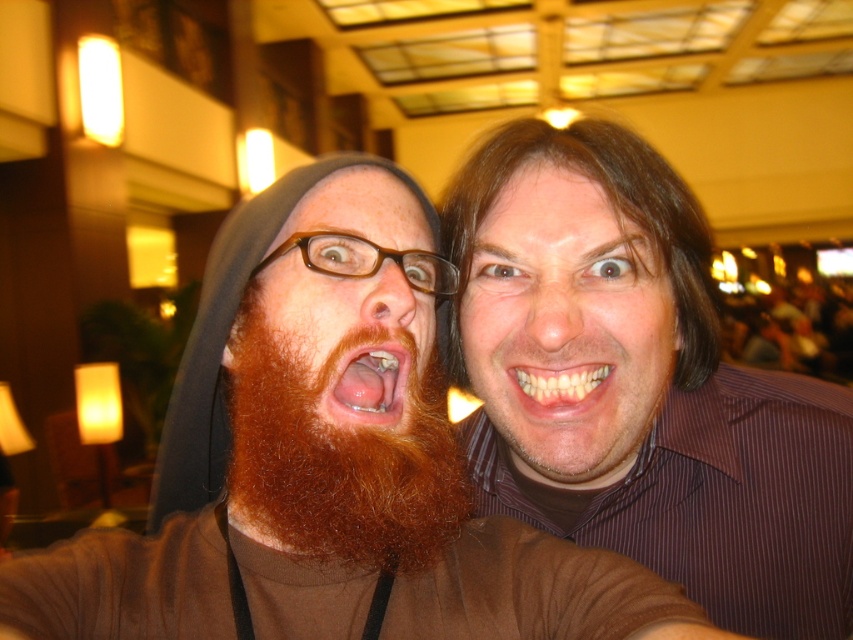
Question: Is matte brown shirt at right behind pink flesh at center?

Choices:
 (A) yes
 (B) no

Answer: (A)

Question: Which is farther from the brown matte beard at center?

Choices:
 (A) yellowish matte teeth at center
 (B) pink flesh at center

Answer: (A)

Question: Can you confirm if brown striped shirt at center is positioned below brown matte beard at center?

Choices:
 (A) yes
 (B) no

Answer: (A)

Question: Does brown striped shirt at center have a lesser width compared to matte brown shirt at right?

Choices:
 (A) no
 (B) yes

Answer: (A)

Question: Which point is farther to the camera?

Choices:
 (A) (525, 380)
 (B) (367, 228)
 (C) (486, 170)
 (D) (439, 419)

Answer: (C)

Question: Which point is farther from the camera taking this photo?

Choices:
 (A) (305, 531)
 (B) (578, 156)
 (C) (563, 372)

Answer: (B)